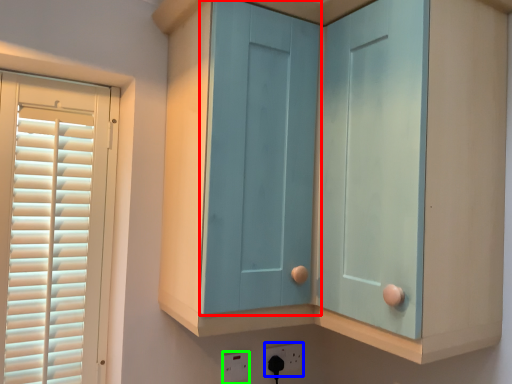
Question: Based on their relative distances, which object is nearer to screen door (highlighted by a red box)? Choose from electric outlet (highlighted by a blue box) and electric outlet (highlighted by a green box).

Choices:
 (A) electric outlet
 (B) electric outlet

Answer: (B)